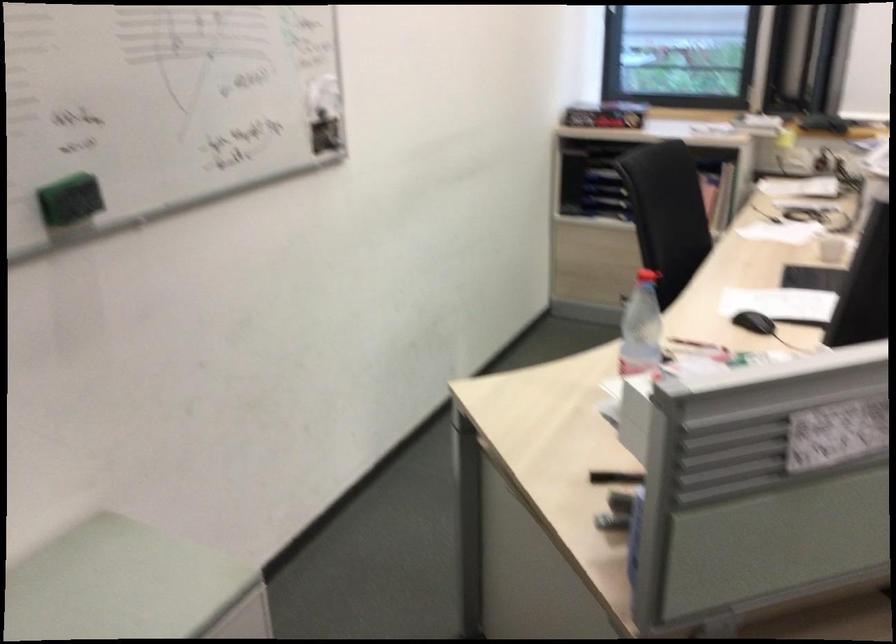
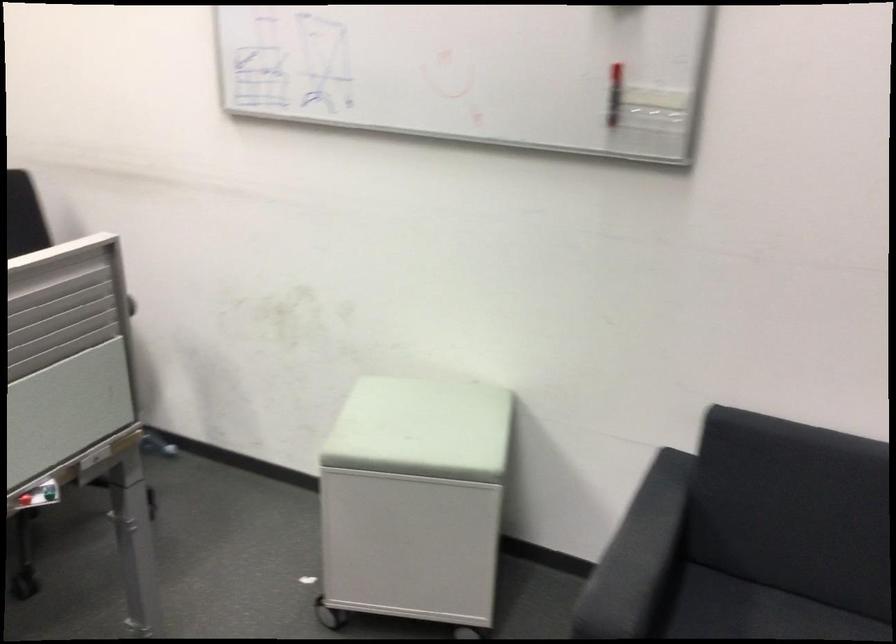
In the scene shown: First-person continuous shooting, in which direction is the camera rotating?

The camera rotated toward right-down.